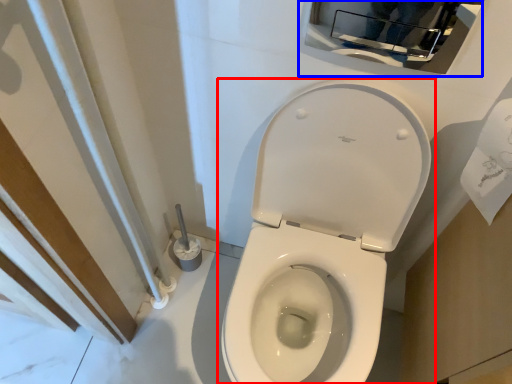
Question: Among these objects, which one is nearest to the camera, toilet (highlighted by a red box) or medicine cabinet (highlighted by a blue box)?

Choices:
 (A) toilet
 (B) medicine cabinet

Answer: (A)